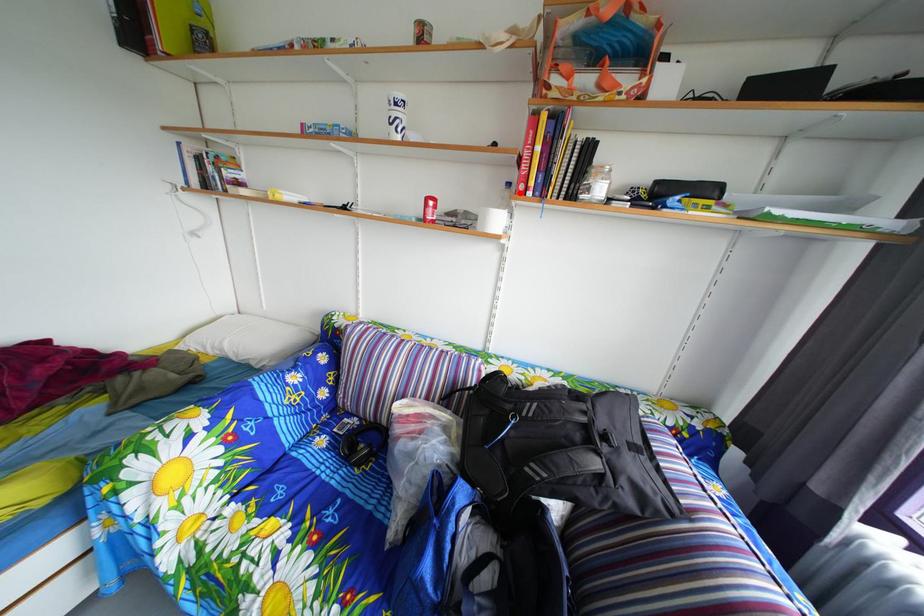
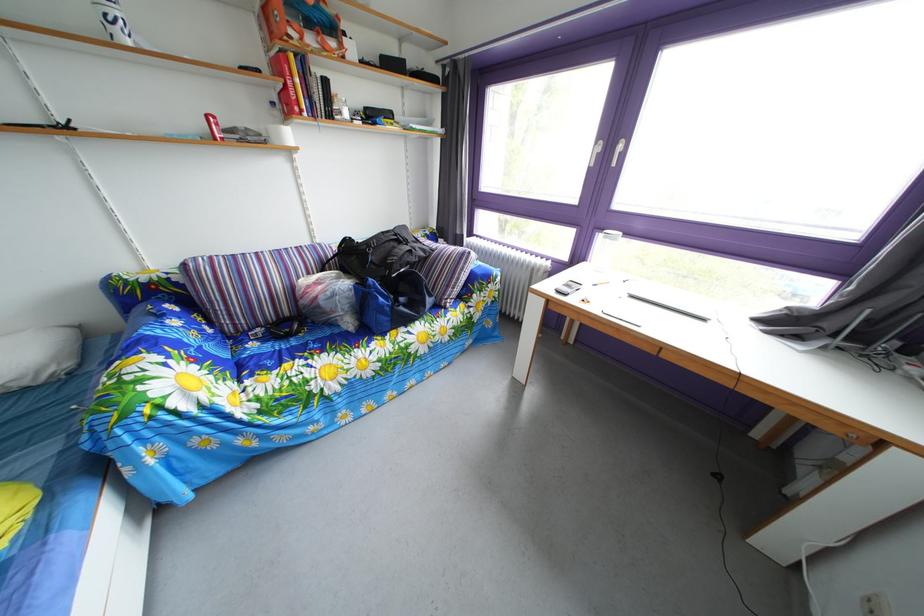
Find the pixel in the second image that matches the highlighted location in the first image.

(284, 111)